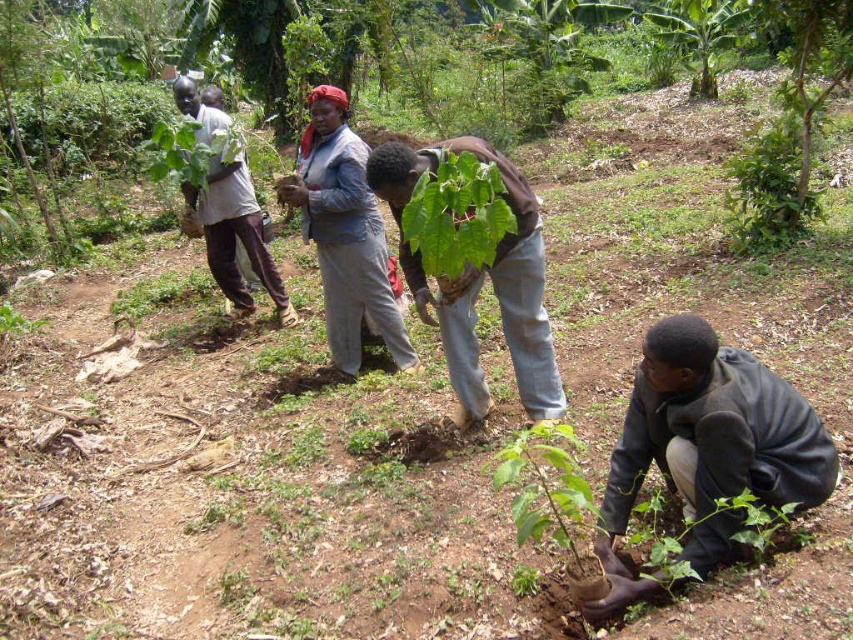
Question: Which point is closer to the camera taking this photo?

Choices:
 (A) (483, 401)
 (B) (355, 330)
 (C) (434, 269)

Answer: (C)

Question: Which object is positioned farthest from the green leafy plant at lower center?

Choices:
 (A) green leafy plant at upper right
 (B) green leafy plant at center
 (C) green matte plant at center

Answer: (A)

Question: Among these objects, which one is farthest from the camera?

Choices:
 (A) green leafy plant at lower center
 (B) light brown fabric shirt at upper left
 (C) green leafy plant at center

Answer: (B)

Question: Where is light gray fabric at center located in relation to green leafy plant at center in the image?

Choices:
 (A) below
 (B) above

Answer: (B)

Question: From the image, what is the correct spatial relationship of green matte plant at center in relation to green leafy plant at center?

Choices:
 (A) above
 (B) below

Answer: (B)

Question: Where is light gray fabric at center located in relation to green leafy plant at center in the image?

Choices:
 (A) left
 (B) right

Answer: (A)